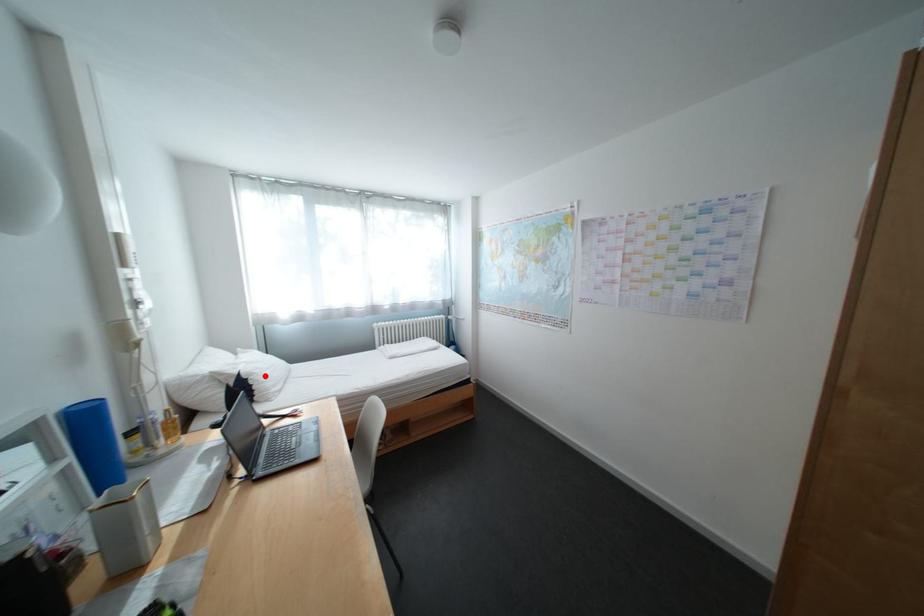
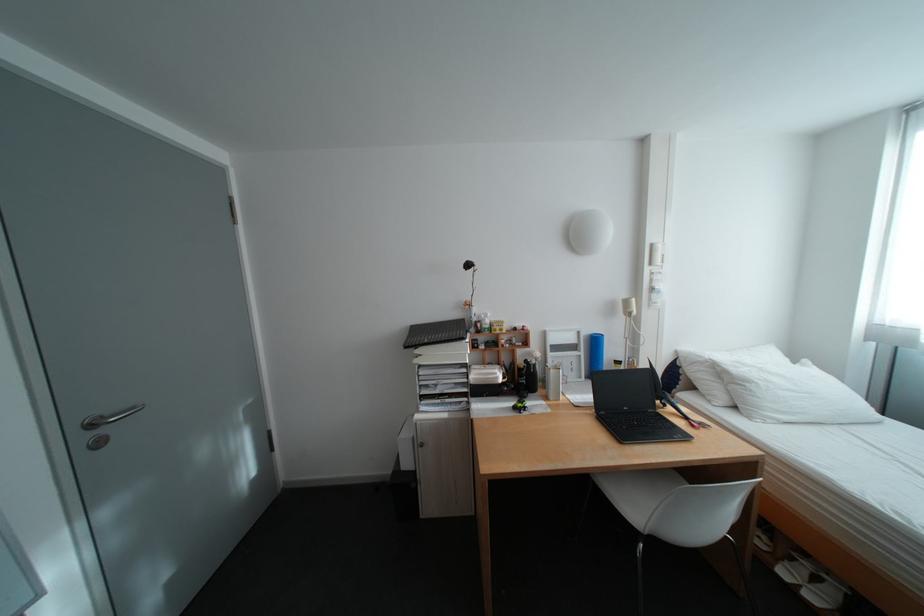
Where in the second image is the point corresponding to the highlighted location from the first image?

(761, 384)